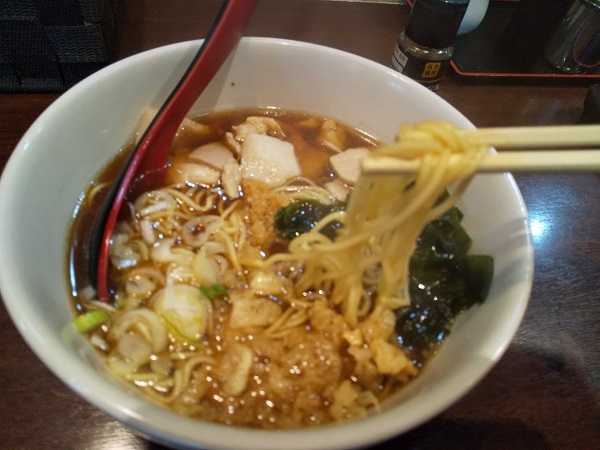
Where is `tray`? tray is located at coordinates (493, 45).